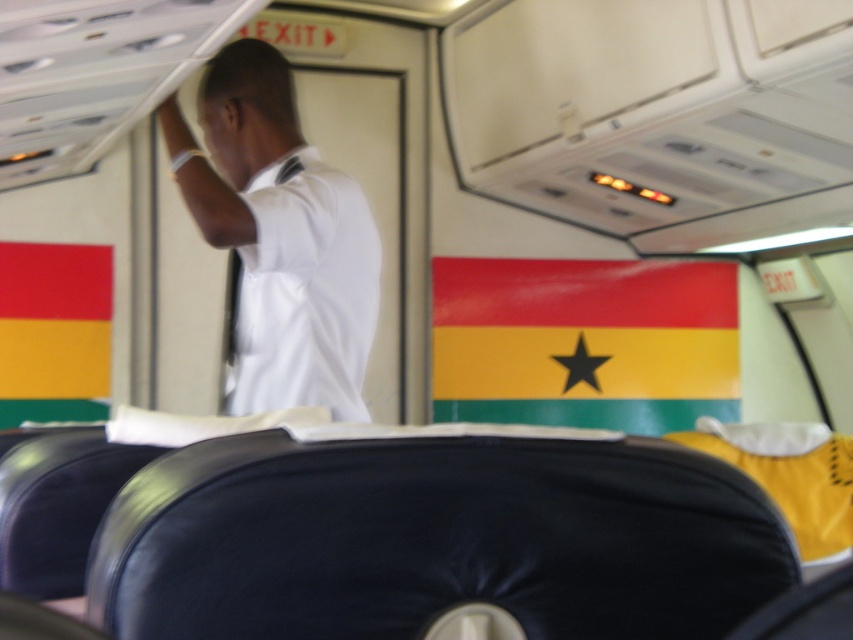
Question: Does white shirt at upper center appear on the right side of shiny plastic flag at center?

Choices:
 (A) yes
 (B) no

Answer: (B)

Question: Which object appears farthest from the camera in this image?

Choices:
 (A) shiny plastic flag at center
 (B) white shirt at upper center

Answer: (A)

Question: Does white shirt at upper center come behind shiny plastic flag at center?

Choices:
 (A) yes
 (B) no

Answer: (B)

Question: Which object is farther from the camera taking this photo?

Choices:
 (A) white shirt at upper center
 (B) shiny plastic flag at center

Answer: (B)

Question: Among these points, which one is nearest to the camera?

Choices:
 (A) (247, 180)
 (B) (688, 324)

Answer: (A)

Question: Is the position of white shirt at upper center more distant than that of shiny plastic flag at center?

Choices:
 (A) no
 (B) yes

Answer: (A)